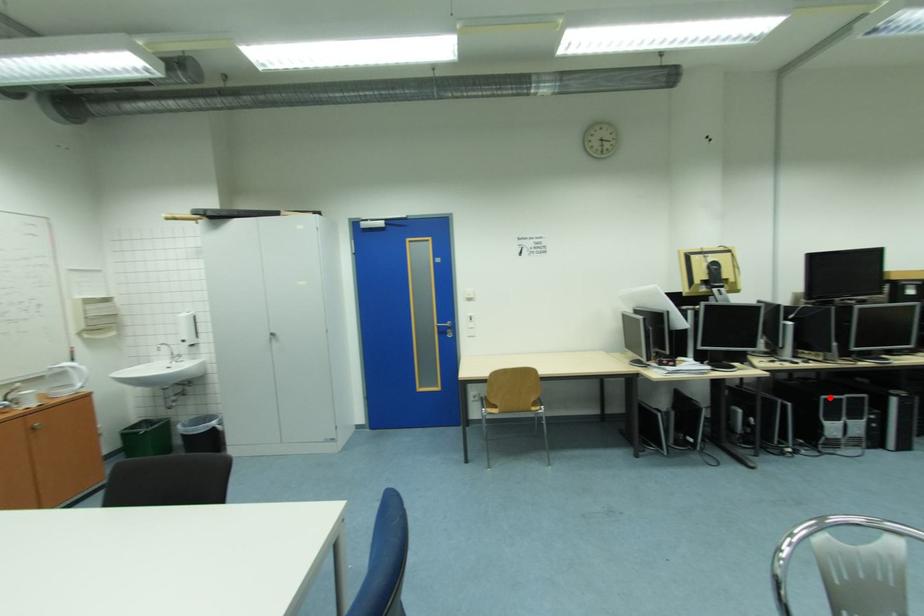
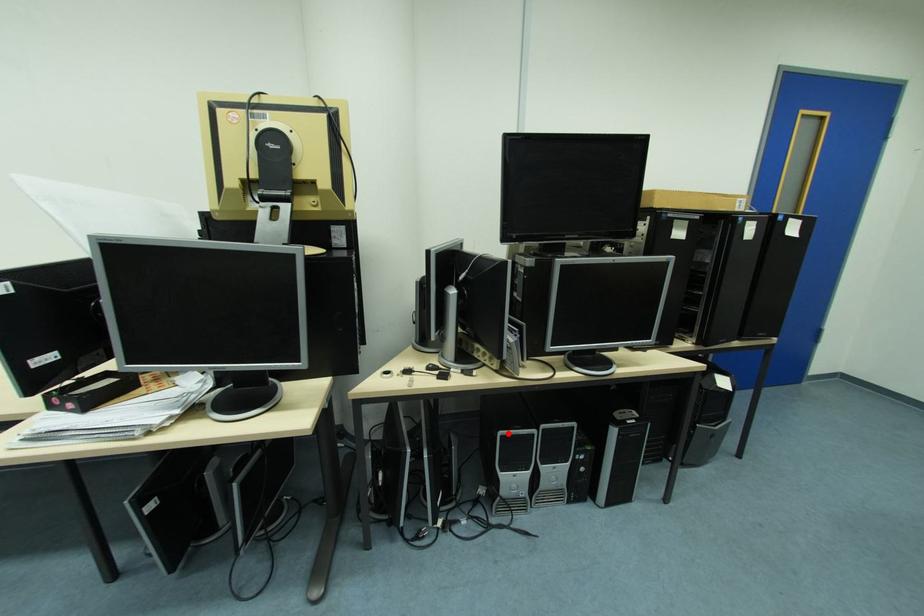
I am providing you with two images of the same scene from different viewpoints. A red point is marked on the first image and another point is marked on the second image. Do the highlighted points in image1 and image2 indicate the same real-world spot?

Yes